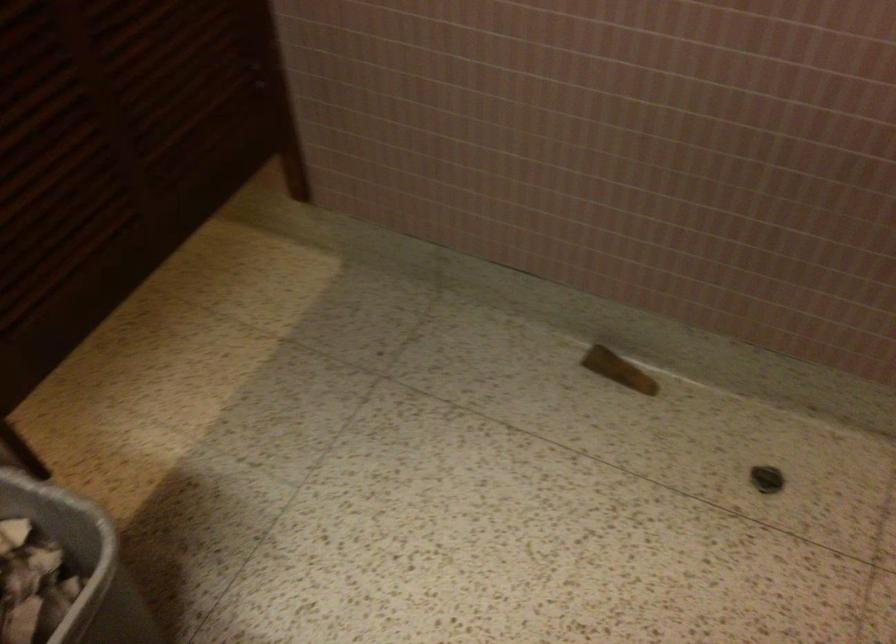
This screenshot has width=896, height=644. Identify the location of brown doorstop. (118, 158).